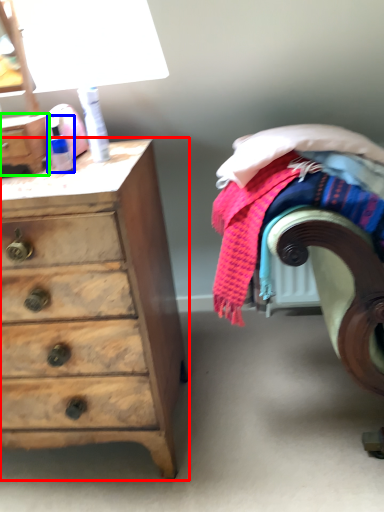
Question: Estimate the real-world distances between objects in this image. Which object is farther from chest of drawers (highlighted by a red box), toiletry (highlighted by a blue box) or chest (highlighted by a green box)?

Choices:
 (A) toiletry
 (B) chest

Answer: (A)